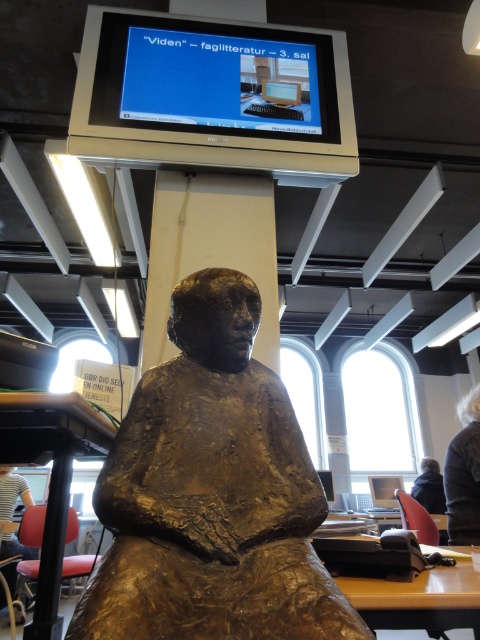
Question: Does wooden table at lower center come behind dark brown hair at lower right?

Choices:
 (A) no
 (B) yes

Answer: (A)

Question: Does dark blue fabric jacket at lower right come in front of matte black monitor at center?

Choices:
 (A) no
 (B) yes

Answer: (B)

Question: In this image, where is wooden table at lower center located relative to dark brown hair at lower right?

Choices:
 (A) below
 (B) above

Answer: (A)

Question: Which point is farther to the camera?

Choices:
 (A) wooden table at lower center
 (B) matte black monitor at center
 (C) black matte table at lower left
 (D) bronze statue at center

Answer: (B)

Question: Based on their relative distances, which object is nearer to the dark brown hair at lower right?

Choices:
 (A) matte black monitor at center
 (B) black matte table at lower left

Answer: (B)

Question: Estimate the real-world distances between objects in this image. Which object is closer to the black matte table at lower left?

Choices:
 (A) dark blue fabric jacket at lower right
 (B) bronze statue at center

Answer: (B)